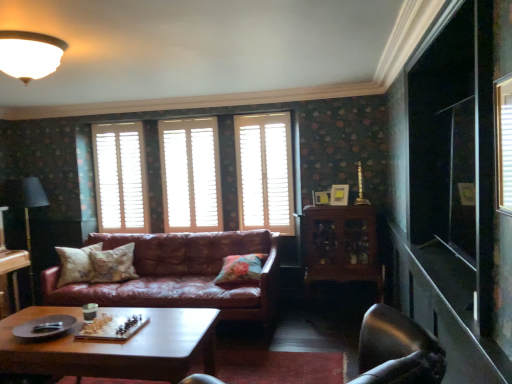
Question: Relative to matte white picture frame at center, the first picture frame positioned from the left, is metallic silver swivel chair at lower right in front or behind?

Choices:
 (A) front
 (B) behind

Answer: (A)

Question: Considering the relative positions of metallic silver swivel chair at lower right and matte white picture frame at center, the first picture frame positioned from the left, in the image provided, is metallic silver swivel chair at lower right to the left or to the right of matte white picture frame at center, the first picture frame positioned from the left,?

Choices:
 (A) left
 (B) right

Answer: (A)

Question: Which is farther from the leather couch at center?

Choices:
 (A) fluffy beige pillow at center, marked as the second pillow in a right-to-left arrangement
 (B) matte gold picture frame at upper center, which is counted as the 1th picture frame, starting from the right
 (C) floral fabric pillow at center, acting as the 3th pillow starting from the right
 (D) white wood blinds at center, which is the 2th window in left-to-right order
 (E) white wooden shutters at center, which is the third window in right-to-left order

Answer: (B)

Question: Which is farther from the white wooden shutters at center, arranged as the 3th window when viewed from the left?

Choices:
 (A) matte white ceiling light at upper left
 (B) leather couch at center
 (C) black fabric lamp at left
 (D) matte white picture frame at center, positioned as the 2th picture frame in right-to-left order
 (E) fluffy beige pillow at center, the 2th pillow from the left

Answer: (C)